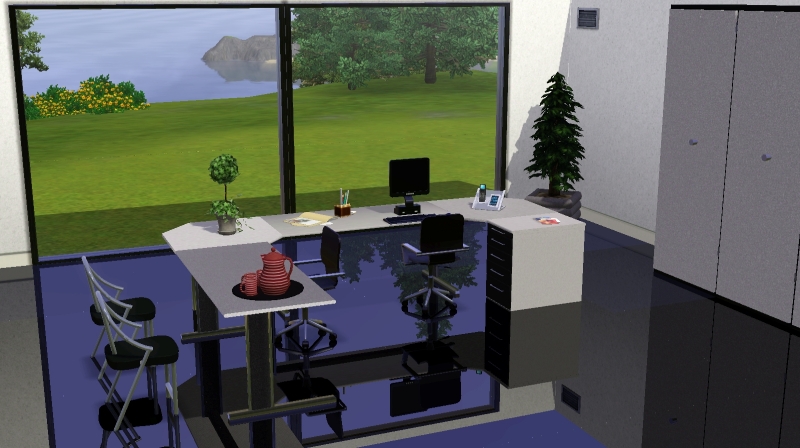
This screenshot has height=448, width=800. In order to click on mug in this screenshot , I will do `click(244, 283)`, `click(256, 271)`.